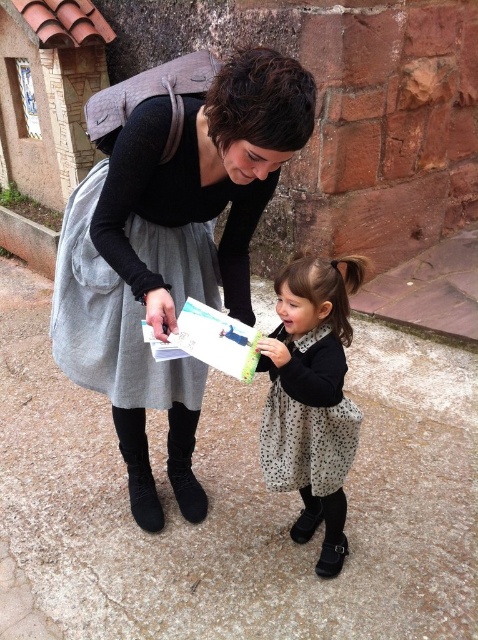
Who is positioned more to the left, matte black dress at center or black suede boot at lower left?

black suede boot at lower left

Does matte black dress at center appear under black suede boot at lower left?

No, matte black dress at center is not below black suede boot at lower left.

Which is behind, point (185, 282) or point (138, 451)?

Positioned behind is point (138, 451).

Where is `matte black dress at center`? matte black dress at center is located at coordinates (172, 224).

Does matte black dress at center appear on the left side of polka dot dress at center?

Correct, you'll find matte black dress at center to the left of polka dot dress at center.

Can you confirm if matte black dress at center is shorter than polka dot dress at center?

No, matte black dress at center is not shorter than polka dot dress at center.

Between point (271, 65) and point (316, 426), which one is positioned behind?

Positioned behind is point (316, 426).

In order to click on matte black dress at center in this screenshot , I will do click(x=172, y=224).

Does matte black dress at center come in front of polka dot fabric dress at lower center?

Yes, it is.

Is point (290, 58) behind point (334, 416)?

Yes, it is.

Identify the location of matte black dress at center. (172, 224).